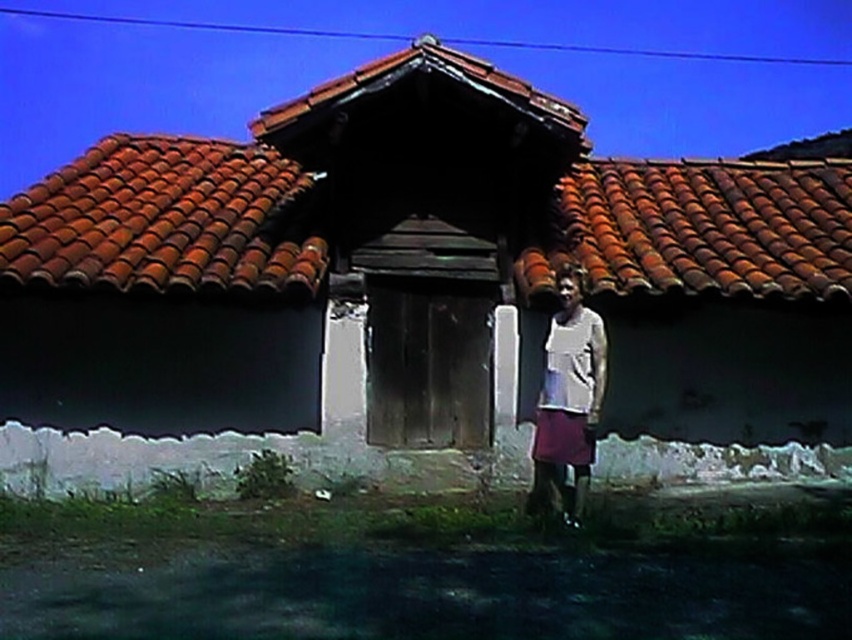
Looking at this image, between terracotta tiles at center and white matte shirt at right, which one has more height?

terracotta tiles at center

Based on the photo, is terracotta tiles at center shorter than white matte shirt at right?

No.

Which is behind, point (677, 202) or point (579, 460)?

The point (677, 202) is behind.

You are a GUI agent. You are given a task and a screenshot of the screen. Output one action in this format:
    pyautogui.click(x=<x>, y=<y>)
    Task: Click on the terracotta tiles at center
    This screenshot has height=640, width=852.
    Given the screenshot: What is the action you would take?
    pyautogui.click(x=168, y=220)

Between brown tile roof at center and white matte shirt at right, which one has more height?

brown tile roof at center

Is point (341, 132) behind point (568, 323)?

Yes.

At what (x,y) coordinates should I click in order to perform the action: click on brown tile roof at center. Please return your answer as a coordinate pair (x, y). This screenshot has width=852, height=640. Looking at the image, I should click on (419, 291).

Is brown tile roof at center taller than terracotta tiles at center?

Yes, brown tile roof at center is taller than terracotta tiles at center.

Between brown tile roof at center and terracotta tiles at center, which one appears on the left side from the viewer's perspective?

Positioned to the left is brown tile roof at center.

Is point (528, 324) in front of point (769, 243)?

No, (528, 324) is behind (769, 243).

I want to click on brown tile roof at center, so click(x=419, y=291).